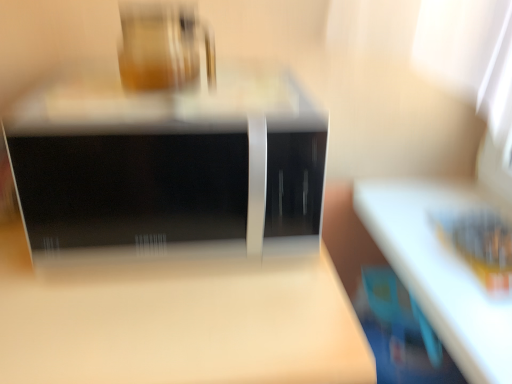
Find the location of a particular element. This screenshot has height=384, width=512. free space in front of matte glass jar at upper center is located at coordinates (148, 118).